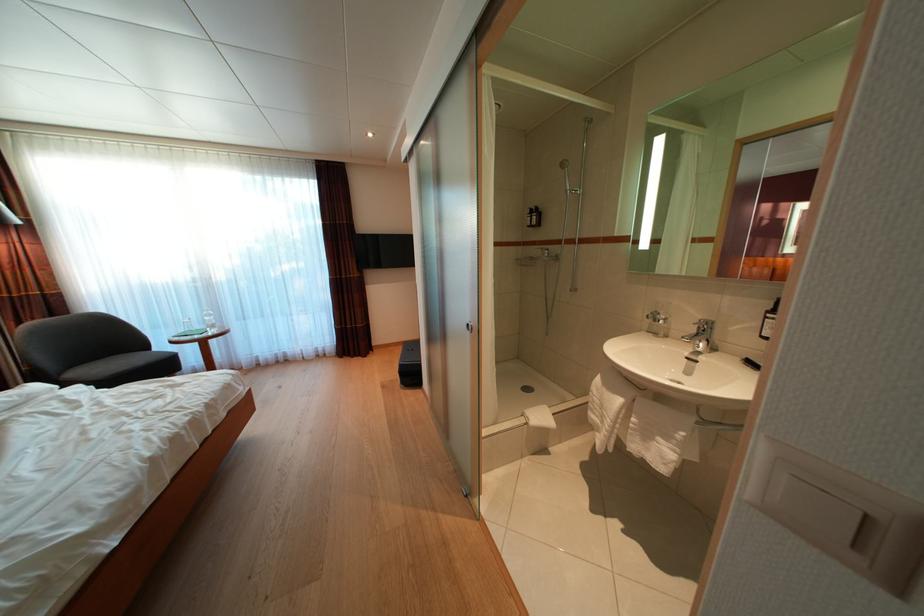
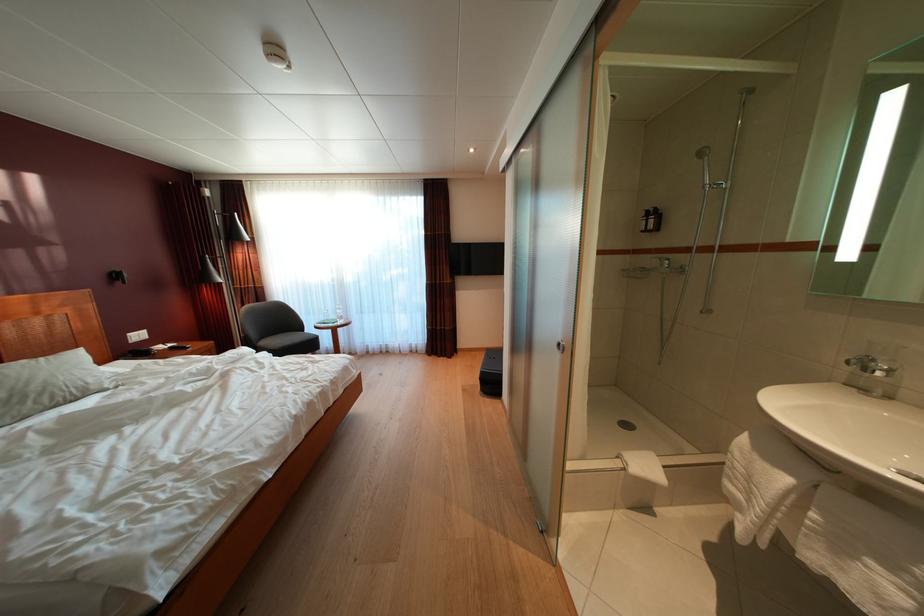
Find the pixel in the second image that matches the point at 655,440 in the first image.

(849, 554)